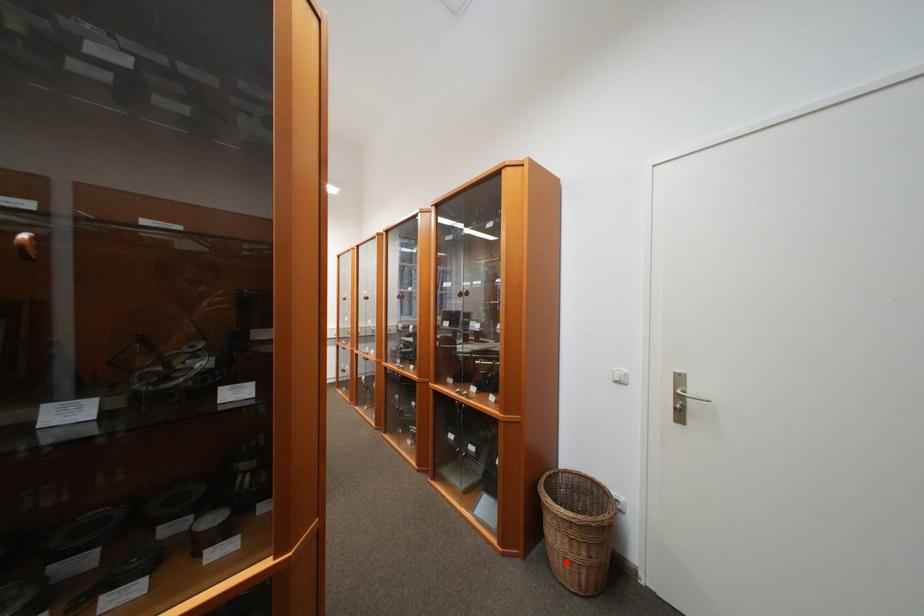
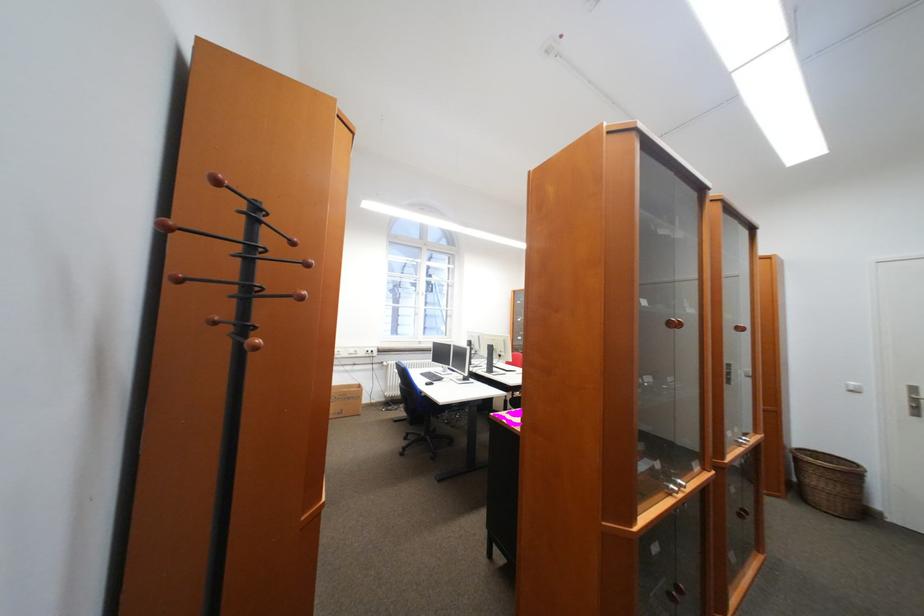
Question: I am providing you with two images of the same scene from different viewpoints. Image1 has a red point marked. In image2, the corresponding 3D location appears at what relative position? Reply with the corresponding letter.

Choices:
 (A) Closer
 (B) Farther

Answer: (A)